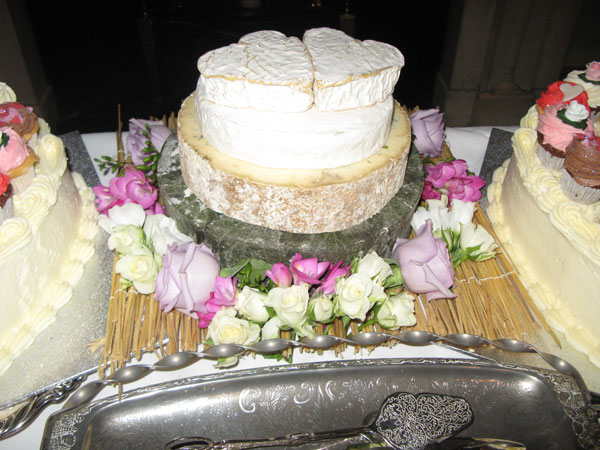
Image resolution: width=600 pixels, height=450 pixels. In order to click on old silver tray in this screenshot , I will do `click(492, 405)`.